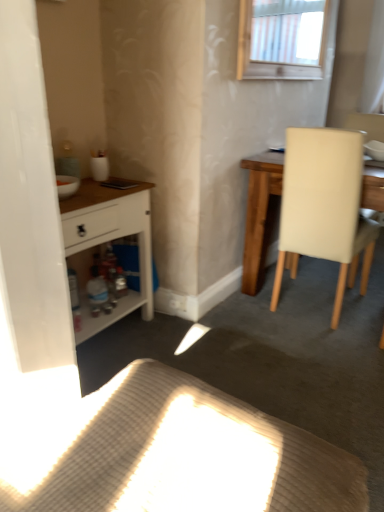
Question: Considering the relative sizes of white glossy bowl at upper right and white matte cabinet at left in the image provided, is white glossy bowl at upper right shorter than white matte cabinet at left?

Choices:
 (A) no
 (B) yes

Answer: (B)

Question: From a real-world perspective, is white glossy bowl at upper right physically above white matte cabinet at left?

Choices:
 (A) no
 (B) yes

Answer: (B)

Question: From the image's perspective, does white glossy bowl at upper right appear lower than white matte cabinet at left?

Choices:
 (A) yes
 (B) no

Answer: (B)

Question: Is white glossy bowl at upper right positioned behind white matte cabinet at left?

Choices:
 (A) no
 (B) yes

Answer: (B)

Question: From the image's perspective, is white glossy bowl at upper right on white matte cabinet at left?

Choices:
 (A) yes
 (B) no

Answer: (A)

Question: Visually, is white matte cabinet at left positioned to the left or to the right of woven fabric cushion at lower center?

Choices:
 (A) left
 (B) right

Answer: (A)

Question: Is point (82, 204) positioned closer to the camera than point (198, 454)?

Choices:
 (A) farther
 (B) closer

Answer: (A)

Question: Considering their positions, is white matte cabinet at left located in front of or behind woven fabric cushion at lower center?

Choices:
 (A) behind
 (B) front

Answer: (A)

Question: Based on their sizes in the image, would you say white matte cabinet at left is bigger or smaller than woven fabric cushion at lower center?

Choices:
 (A) small
 (B) big

Answer: (A)

Question: Is point (380, 147) closer or farther from the camera than point (367, 282)?

Choices:
 (A) farther
 (B) closer

Answer: (B)

Question: Considering the positions of white glossy bowl at upper right and beige leather chair at right in the image, is white glossy bowl at upper right wider or thinner than beige leather chair at right?

Choices:
 (A) wide
 (B) thin

Answer: (B)

Question: Considering their positions, is white glossy bowl at upper right located in front of or behind beige leather chair at right?

Choices:
 (A) behind
 (B) front

Answer: (A)

Question: From the image's perspective, is white glossy bowl at upper right positioned above or below beige leather chair at right?

Choices:
 (A) above
 (B) below

Answer: (A)

Question: From the image's perspective, relative to woven fabric cushion at lower center, is beige leather chair at right above or below?

Choices:
 (A) above
 (B) below

Answer: (A)

Question: Considering the positions of beige leather chair at right and woven fabric cushion at lower center in the image, is beige leather chair at right bigger or smaller than woven fabric cushion at lower center?

Choices:
 (A) small
 (B) big

Answer: (B)